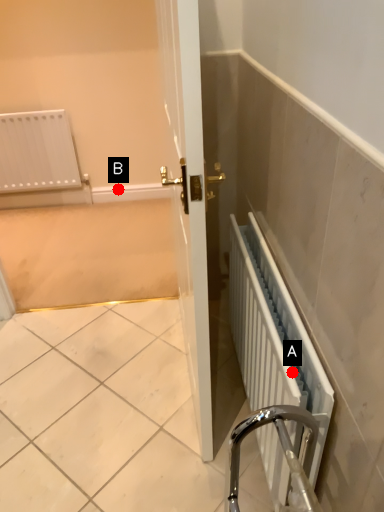
Question: Two points are circled on the image, labeled by A and B beside each circle. Which point is closer to the camera?

Choices:
 (A) A is closer
 (B) B is closer

Answer: (A)